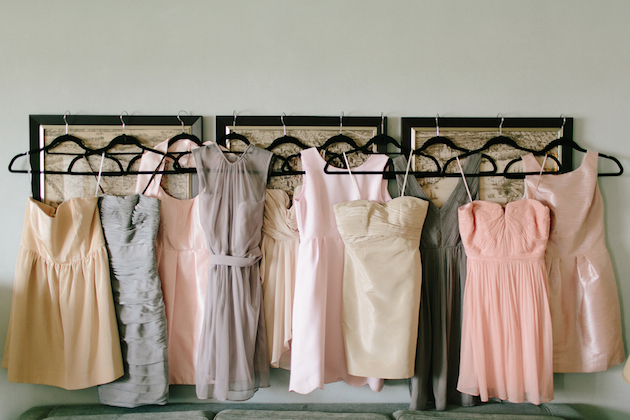
Find the location of a particular element. black hangers is located at coordinates (65, 138), (128, 144), (183, 133), (229, 139), (284, 142), (336, 142), (384, 139), (501, 142), (568, 142), (443, 142).